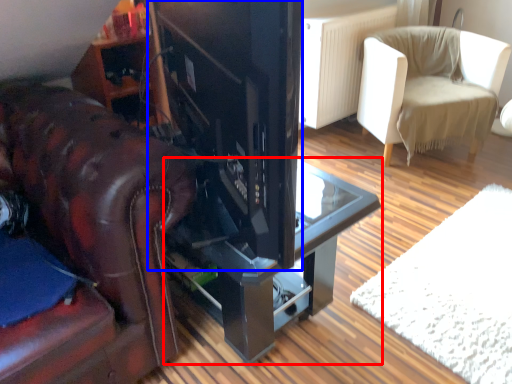
Question: Which object is further to the camera taking this photo, table (highlighted by a red box) or appliance (highlighted by a blue box)?

Choices:
 (A) table
 (B) appliance

Answer: (A)